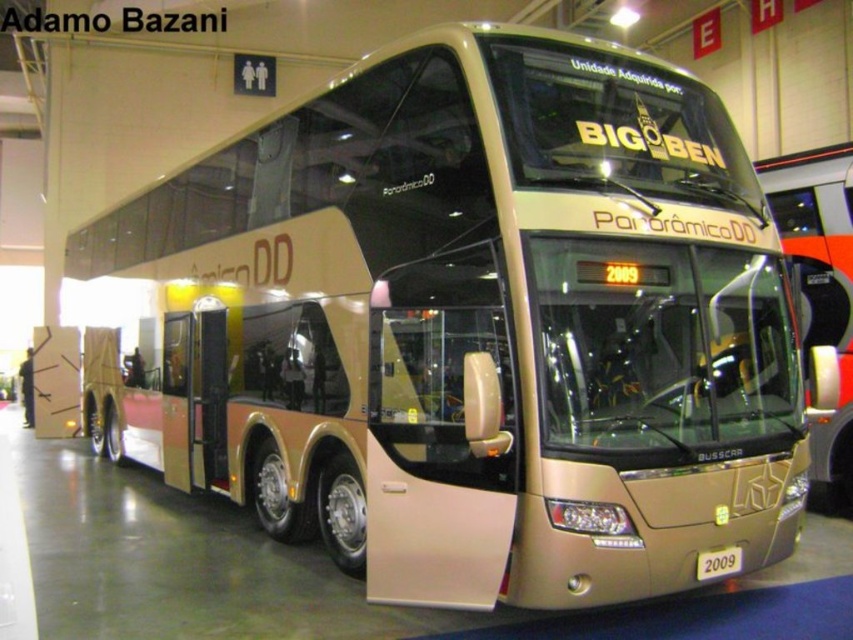
You are a tour guide explaining the Panoramic DD bus to visitors. You want to highlight the size difference between the gold metallic bus at center and the gold metallic license plate at center. How would you describe their sizes?

The gold metallic bus at center is significantly larger than the gold metallic license plate at center, which is a small rectangular plate attached to the vehicle.